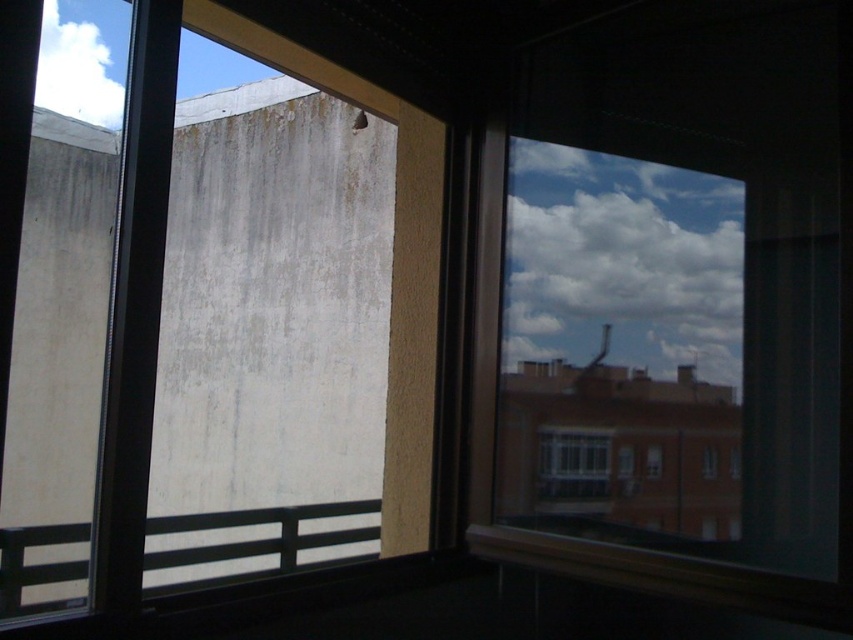
Question: Does transparent glass window at upper right have a greater width compared to clear glass window at center?

Choices:
 (A) yes
 (B) no

Answer: (A)

Question: Which point is closer to the camera?

Choices:
 (A) transparent glass window at upper right
 (B) clear glass window at center

Answer: (A)

Question: Which point is farther to the camera?

Choices:
 (A) clear glass window at center
 (B) transparent glass window at upper right

Answer: (A)

Question: Which point appears farthest from the camera in this image?

Choices:
 (A) (589, 436)
 (B) (498, 422)

Answer: (B)

Question: Does transparent glass window at upper right have a smaller size compared to clear glass window at center?

Choices:
 (A) no
 (B) yes

Answer: (A)

Question: Does transparent glass window at upper right have a larger size compared to clear glass window at center?

Choices:
 (A) yes
 (B) no

Answer: (A)